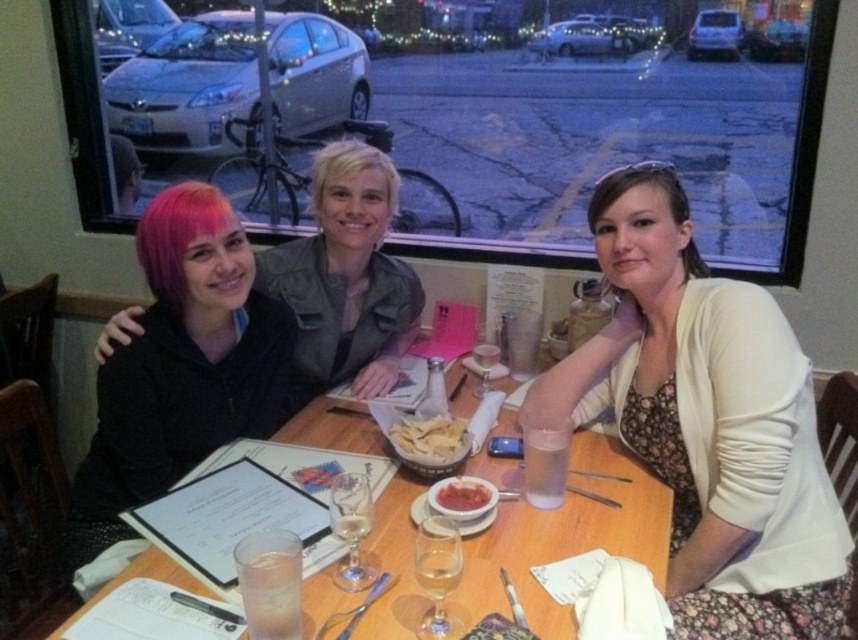
You are a server at a restaurant who needs to place a new drink order on the table. The table has a blondehair at center and a smooth matte red sauce at center. To ensure you don not spill the sauce, where should you place the drink relative to these items?

The blondehair at center is closer to you than the smooth matte red sauce at center, so placing the drink near the blondehair at center would be safer to avoid spilling on the sauce.

You are a waiter trying to place a new menu on the table. You have two options for placement based on coordinates given as points. The first option is at point (686, 211), and the second is at point (363, 148). Which point is closer to you so you can place the menu there without stretching?

Point (686, 211) is closer to the viewer than point (363, 148), so you should place the menu at point (686, 211) to avoid stretching.

You are at the center of the table. Which direction should you look to see the blondehair at center?

The blondehair at center is located at point coordinates of (351, 170), which is slightly to the left and lower than the center point of the table. Therefore, you should look slightly to the left and downward from the center to see the blondehair at center.